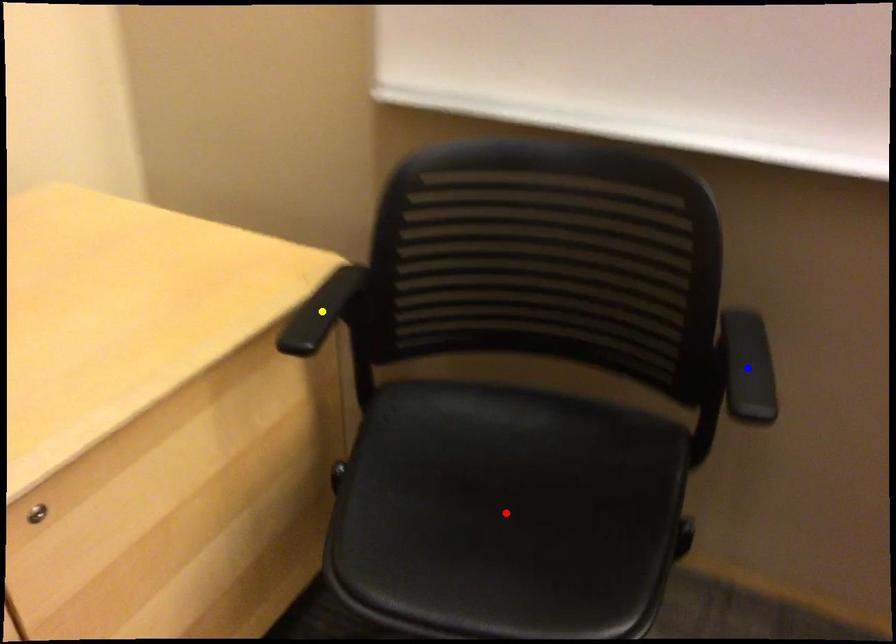
Order these from nearest to farthest:
1. red point
2. yellow point
3. blue point

red point
blue point
yellow point